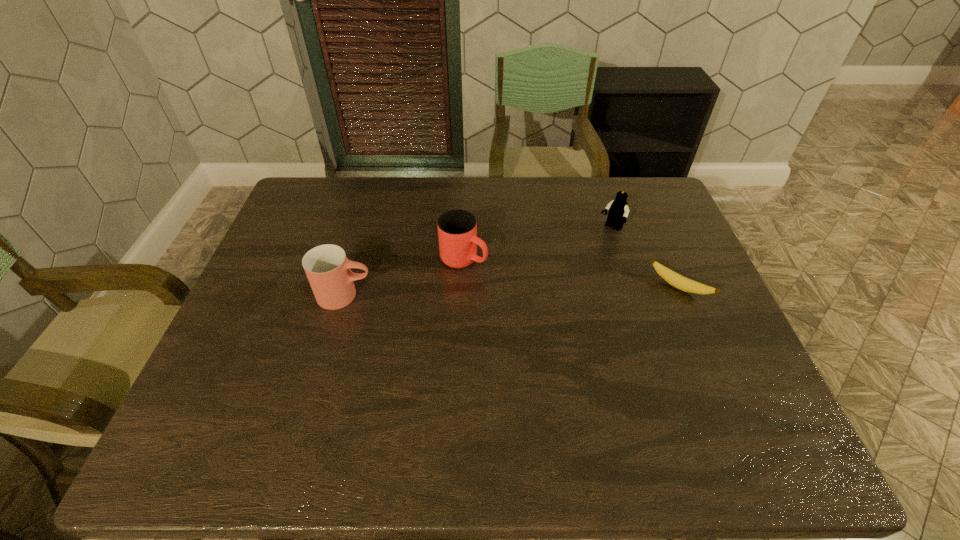
At what (x,y) coordinates should I click in order to perform the action: click on the nearer cup. Please return your answer as a coordinate pair (x, y). Looking at the image, I should click on (327, 268).

Where is `the leftmost object`? the leftmost object is located at coordinates (327, 268).

Find the location of a particular element. the shortest object is located at coordinates (685, 284).

Image resolution: width=960 pixels, height=540 pixels. What are the coordinates of `the rightmost object` in the screenshot? It's located at (685, 284).

I want to click on the farther cup, so click(x=457, y=229).

Find the location of a particular element. The height and width of the screenshot is (540, 960). the right cup is located at coordinates (457, 229).

Where is `the third object from left to right`? The image size is (960, 540). the third object from left to right is located at coordinates (618, 211).

Locate an element on the screen. Image resolution: width=960 pixels, height=540 pixels. Lego is located at coordinates (618, 211).

At what (x,y) coordinates should I click in order to perform the action: click on vacant space located on the side of the nearer cup with the handle. Please return your answer as a coordinate pair (x, y). The height and width of the screenshot is (540, 960). Looking at the image, I should click on (475, 295).

Find the location of a particular element. vacant point located on the left of the banana is located at coordinates (573, 287).